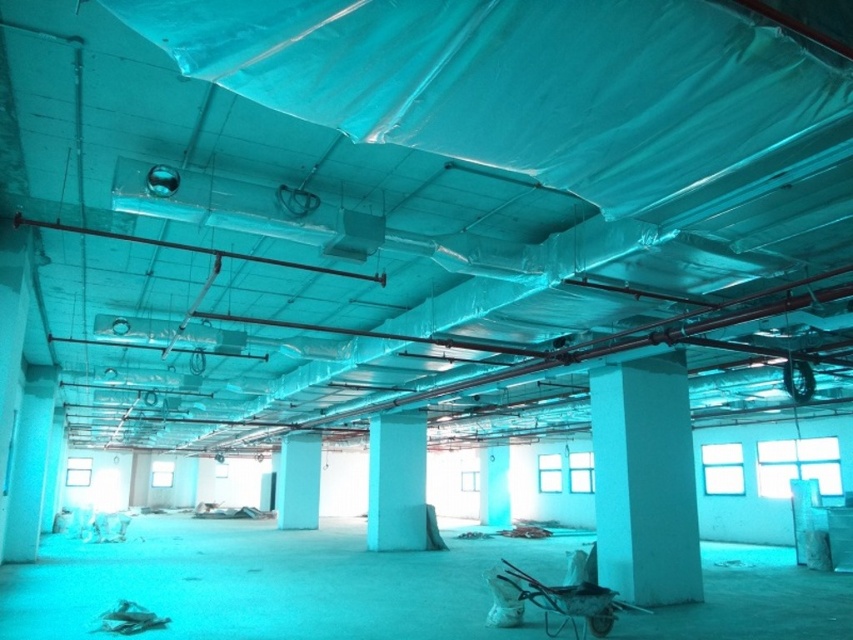
Does white smooth column at center have a greater width compared to white smooth pillar at center?

Yes.

Is white smooth column at center positioned behind white smooth pillar at center?

That is False.

The width and height of the screenshot is (853, 640). Find the location of `white smooth column at center`. white smooth column at center is located at coordinates (645, 481).

Is smooth concrete pillar at center bigger than metallic wire cart at lower right?

Correct, smooth concrete pillar at center is larger in size than metallic wire cart at lower right.

Find the location of a particular element. This screenshot has height=640, width=853. smooth concrete pillar at center is located at coordinates (396, 481).

Is white smooth column at center in front of metallic wire cart at lower right?

No, white smooth column at center is behind metallic wire cart at lower right.

Image resolution: width=853 pixels, height=640 pixels. What do you see at coordinates (645, 481) in the screenshot?
I see `white smooth column at center` at bounding box center [645, 481].

In order to click on white smooth column at center in this screenshot , I will do `click(645, 481)`.